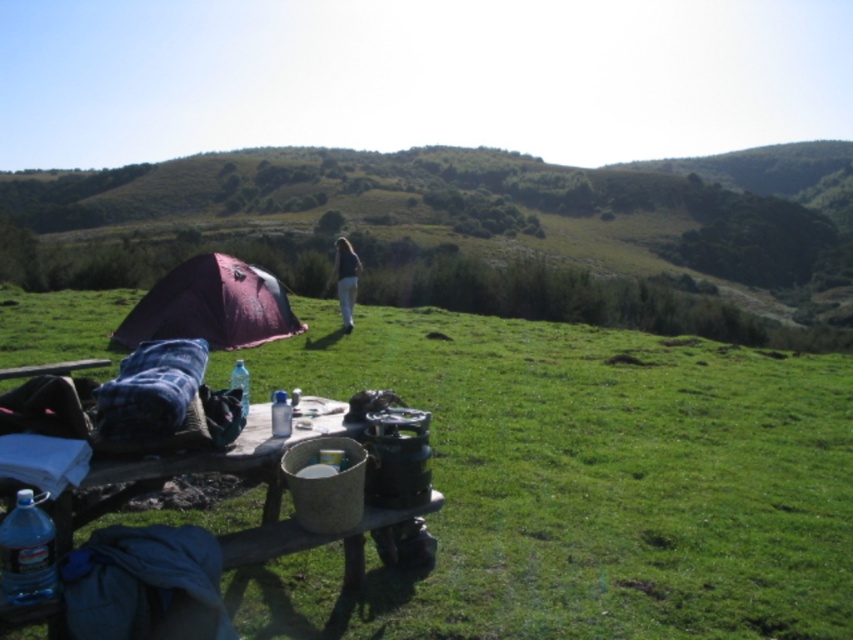
Question: Is purple fabric tent at upper left smaller than dark blue fabric at center?

Choices:
 (A) no
 (B) yes

Answer: (A)

Question: Which object appears closest to the camera in this image?

Choices:
 (A) dark blue fabric at center
 (B) wooden picnic table at lower center
 (C) purple fabric tent at upper left
 (D) green grassy at center

Answer: (B)

Question: Does green grassy at center have a smaller size compared to purple fabric tent at upper left?

Choices:
 (A) yes
 (B) no

Answer: (A)

Question: Which point is farther from the camera taking this photo?

Choices:
 (A) coord(112,506)
 (B) coord(318,320)
 (C) coord(393,157)

Answer: (C)

Question: Can you confirm if wooden picnic table at lower center is positioned below dark blue fabric at center?

Choices:
 (A) no
 (B) yes

Answer: (B)

Question: Which object is closer to the camera taking this photo?

Choices:
 (A) dark blue fabric at center
 (B) purple fabric tent at upper left

Answer: (A)